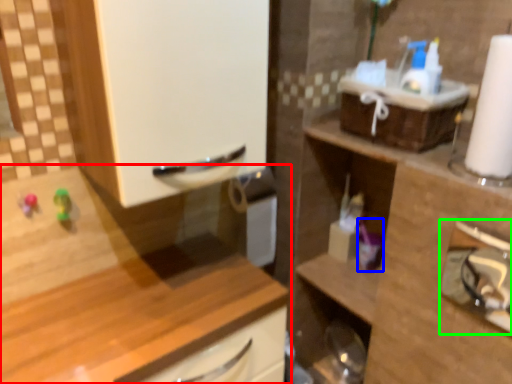
Question: Which is farther away from cabinetry (highlighted by a red box)? toiletry (highlighted by a blue box) or shelf (highlighted by a green box)?

Choices:
 (A) toiletry
 (B) shelf

Answer: (B)